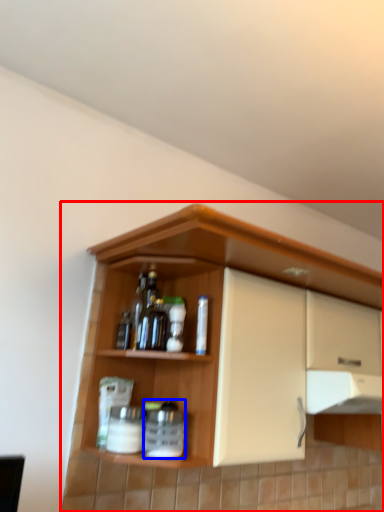
Question: Which point is further to the camera, cupboard (highlighted by a red box) or beverage (highlighted by a blue box)?

Choices:
 (A) cupboard
 (B) beverage

Answer: (B)